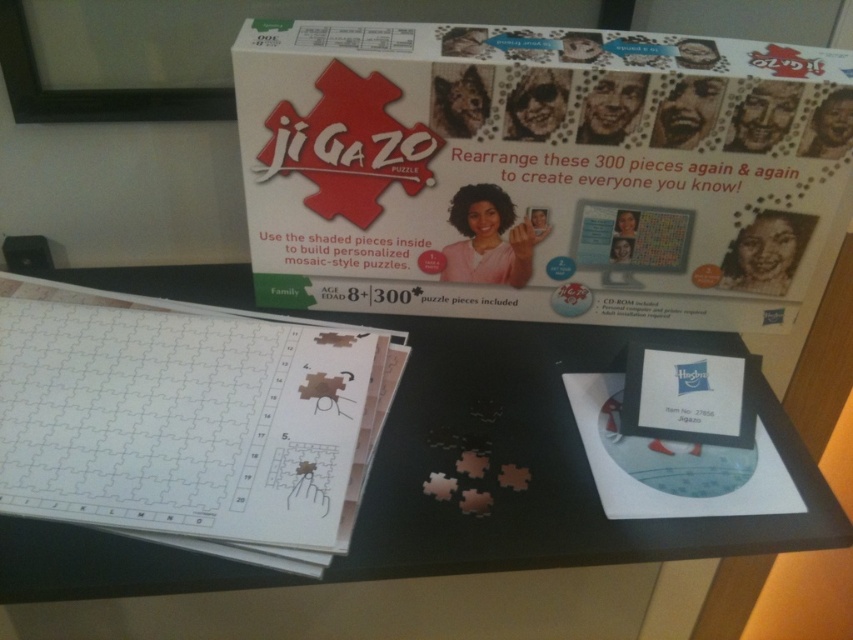
Question: In this image, where is white cardboard poster at upper center located relative to black matte table at center?

Choices:
 (A) left
 (B) right

Answer: (B)

Question: Which point is closer to the camera?

Choices:
 (A) (430, 420)
 (B) (549, 81)

Answer: (B)

Question: Can you confirm if black matte table at center is smaller than white paper puzzle at center?

Choices:
 (A) yes
 (B) no

Answer: (B)

Question: Which object is the closest to the white paper puzzle at center?

Choices:
 (A) black matte table at center
 (B) white cardboard poster at upper center

Answer: (A)

Question: Considering the relative positions of white cardboard poster at upper center and black matte table at center in the image provided, where is white cardboard poster at upper center located with respect to black matte table at center?

Choices:
 (A) right
 (B) left

Answer: (A)

Question: Which point is farther from the camera taking this photo?

Choices:
 (A) (653, 122)
 (B) (537, 371)

Answer: (B)